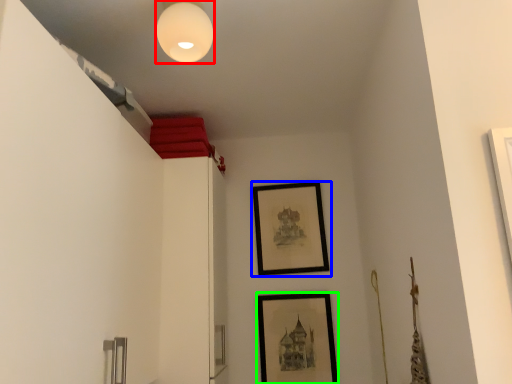
Question: Which object is the farthest from light fixture (highlighted by a red box)? Choose among these: picture frame (highlighted by a blue box) or picture frame (highlighted by a green box).

Choices:
 (A) picture frame
 (B) picture frame

Answer: (B)